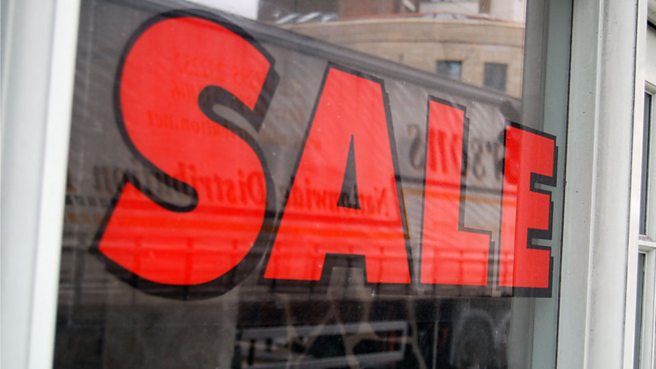
Identify the location of window. (449, 34).